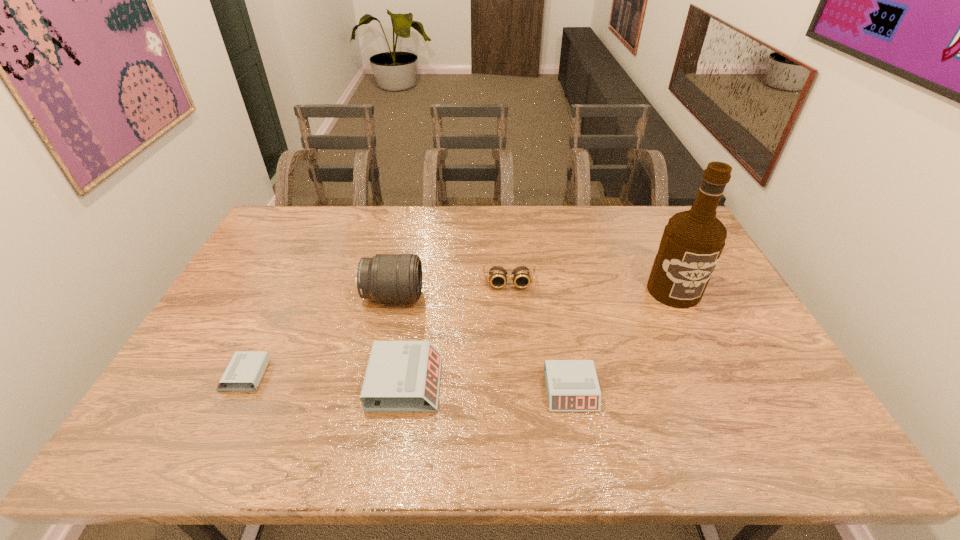
Identify the location of vacant space that satisfies the following two spatial constraints: 1. on the surface of the fifth shortest object; 2. on the right side of the rightmost alarm clock. (372, 390).

The image size is (960, 540). I want to click on free space that satisfies the following two spatial constraints: 1. through the lenses of the goggles; 2. on the surface of the telephoto lens, so click(510, 296).